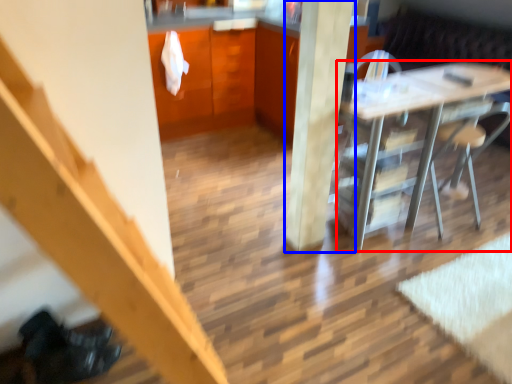
Question: Which object appears closest to the camera in this image, desk (highlighted by a red box) or pillar (highlighted by a blue box)?

Choices:
 (A) desk
 (B) pillar

Answer: (B)